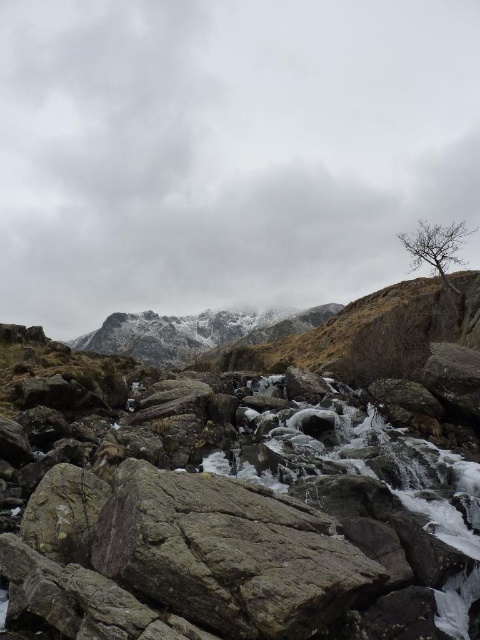
Question: Is the position of gray rough rock at center less distant than that of bare branches at upper right?

Choices:
 (A) yes
 (B) no

Answer: (A)

Question: Can you confirm if gray rough rock at center is positioned to the right of bare branches at upper right?

Choices:
 (A) yes
 (B) no

Answer: (B)

Question: In this image, where is gray rough rock at center located relative to bare branches at upper right?

Choices:
 (A) above
 (B) below

Answer: (B)